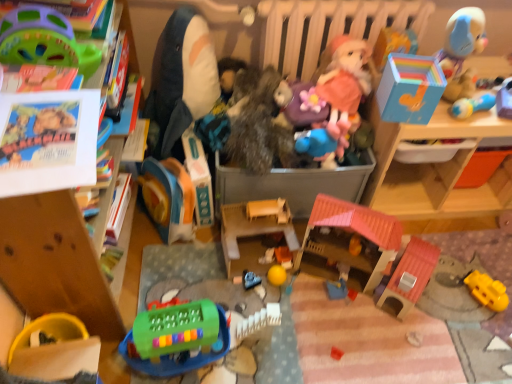
The image size is (512, 384). I want to click on vacant space to the right of green plastic keyboard at lower left, the twelfth toy viewed from the right, so click(x=258, y=347).